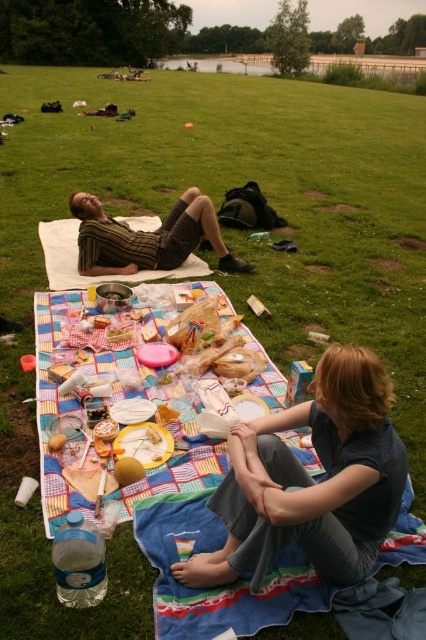
Between point (262, 436) and point (209, 198), which one is positioned behind?

Positioned behind is point (209, 198).

Image resolution: width=426 pixels, height=640 pixels. I want to click on denim jeans at lower right, so click(310, 481).

At what (x,y) coordinates should I click in order to perform the action: click on denim jeans at lower right. Please return your answer as a coordinate pair (x, y). The height and width of the screenshot is (640, 426). Looking at the image, I should click on (310, 481).